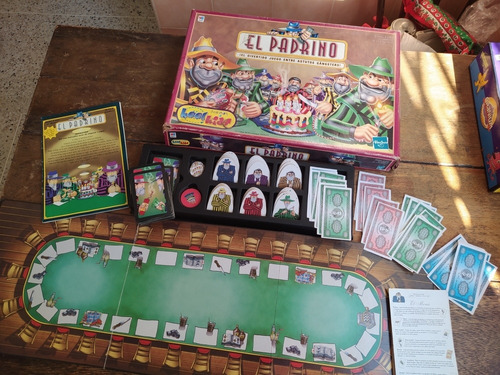
I want to click on pile of play money, so click(325, 217), click(385, 226), click(418, 241), click(475, 271).